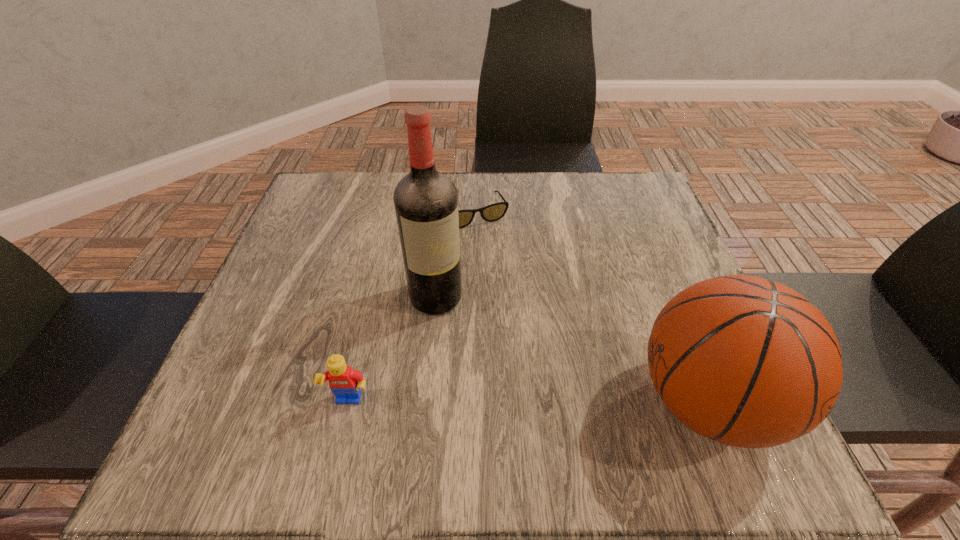
I want to click on vacant space situated on the front-facing side of the liquor, so click(479, 358).

This screenshot has width=960, height=540. I want to click on vacant space positioned on the front-facing side of the liquor, so click(x=463, y=335).

Find the location of a particular element. vacant space situated 0.290m on the front-facing side of the shortest object is located at coordinates (532, 320).

The height and width of the screenshot is (540, 960). Find the location of `blank area located on the front-facing side of the shortest object`. blank area located on the front-facing side of the shortest object is located at coordinates (524, 306).

Find the location of a particular element. This screenshot has height=540, width=960. vacant space located on the front-facing side of the shortest object is located at coordinates (506, 272).

You are a GUI agent. You are given a task and a screenshot of the screen. Output one action in this format:
    pyautogui.click(x=<x>, y=<y>)
    Task: Click on the object that is at the far edge
    
    Given the screenshot: What is the action you would take?
    pyautogui.click(x=493, y=212)

I want to click on Lego that is at the near edge, so click(344, 382).

You are a GUI agent. You are given a task and a screenshot of the screen. Output one action in this format:
    pyautogui.click(x=<x>, y=<y>)
    Task: Click on the basketball situated at the near edge
    The width and height of the screenshot is (960, 540).
    Given the screenshot: What is the action you would take?
    pyautogui.click(x=747, y=362)

Identify the location of object located at the right edge. The width and height of the screenshot is (960, 540). (747, 362).

Identify the location of object at the near right corner. The height and width of the screenshot is (540, 960). (747, 362).